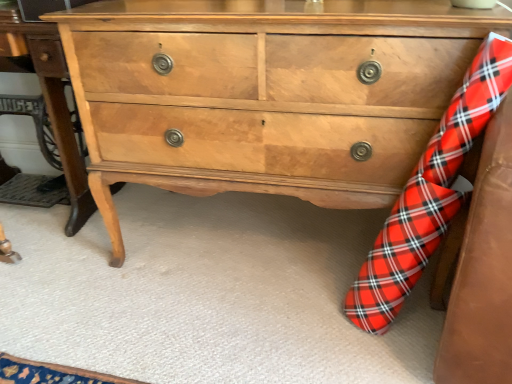
In order to click on vacant location below light brown wood chest of drawers at center (from a real-world perspective) in this screenshot , I will do `click(265, 234)`.